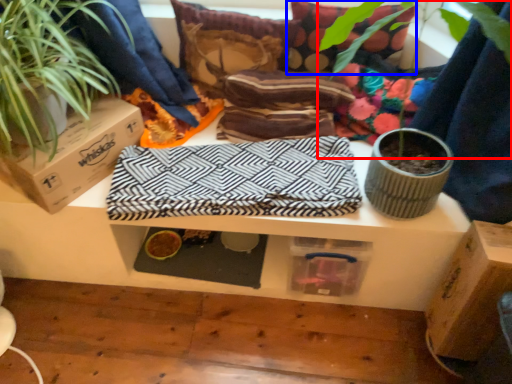
Question: Among these objects, which one is nearest to the camera, vegetation (highlighted by a red box) or pillow (highlighted by a blue box)?

Choices:
 (A) vegetation
 (B) pillow

Answer: (A)